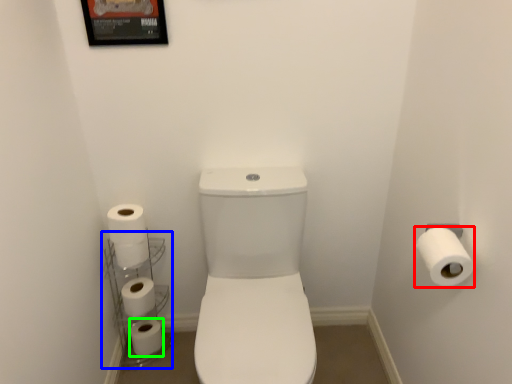
Question: Which object is the closest to the toilet paper (highlighted by a red box)? Choose among these: shelf (highlighted by a blue box) or toilet paper (highlighted by a green box).

Choices:
 (A) shelf
 (B) toilet paper

Answer: (A)